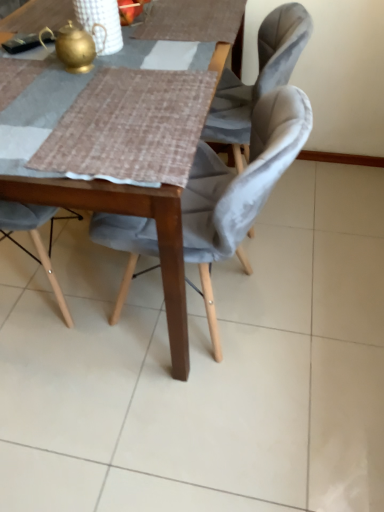
I want to click on empty space that is ontop of velvet grey chair at center (from a real-world perspective), so click(x=156, y=97).